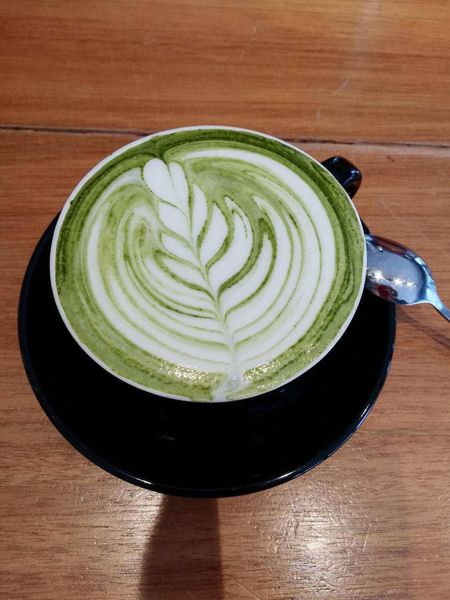
I want to click on cup handle, so click(x=342, y=173).